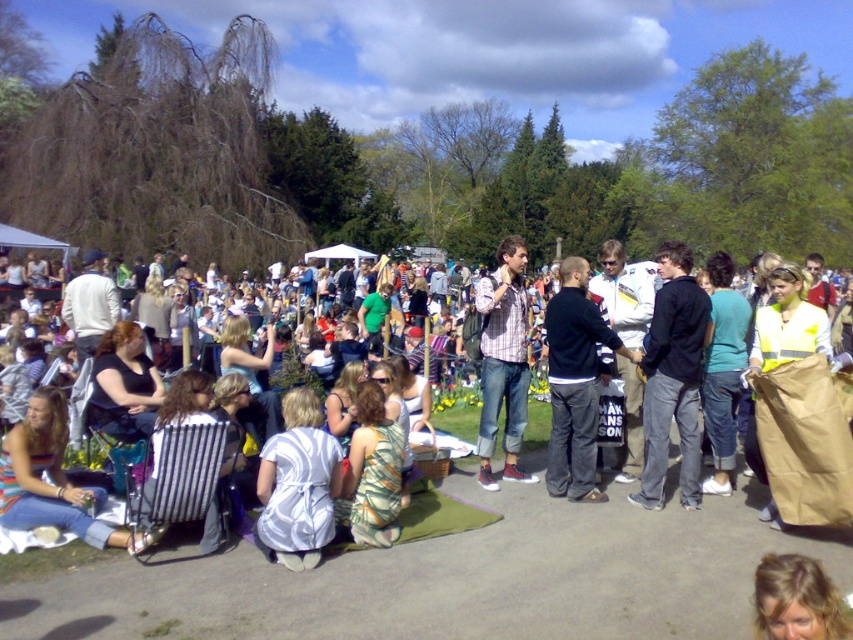
From the picture: You are at a park event and want to take a photo of both the black cotton jacket at center and the plaid shirt at center. However, you notice that one is blocking the other. Which clothing item is blocking the other?

The black cotton jacket at center is blocking the plaid shirt at center because it is positioned in front of it.

You are planning to wear either the black cotton jacket at center or the plaid shirt at center for an upcoming event. Based on the image, which clothing item has a wider width?

The black cotton jacket at center has a wider width than the plaid shirt at center according to the description.